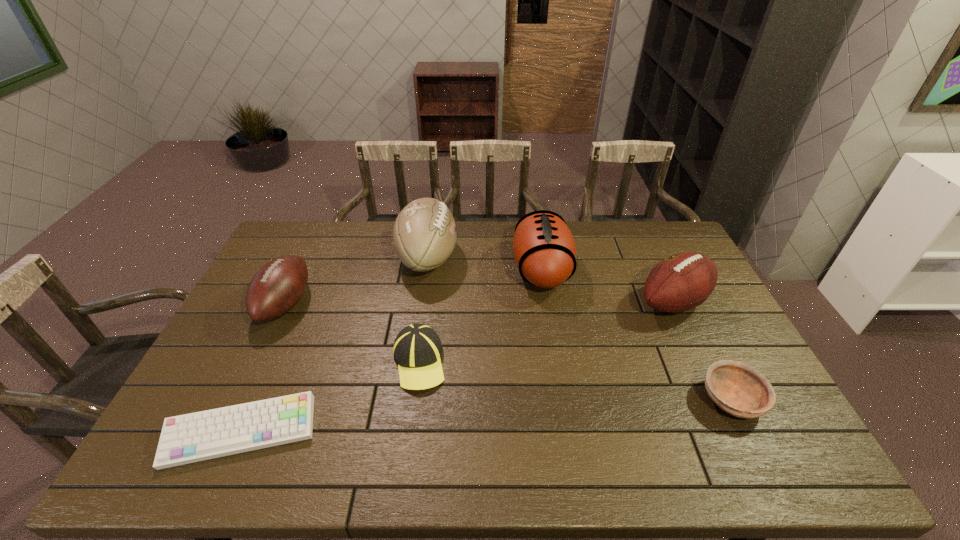
This screenshot has width=960, height=540. Identify the location of vacant space that is in between the fourth tallest object and the second football (American) from left to right. (356, 281).

This screenshot has width=960, height=540. Identify the location of free space between the baseball cap and the second football (American) from right to left. (480, 315).

Identify the location of unoccupied position between the bowl and the computer keyboard. This screenshot has height=540, width=960. (486, 416).

At what (x,y) coordinates should I click in order to perform the action: click on vacant area between the shortest football (American) and the shortest object. Please return your answer as a coordinate pair (x, y). Looking at the image, I should click on (263, 368).

The height and width of the screenshot is (540, 960). I want to click on vacant area that lies between the rightmost football (American) and the bowl, so click(702, 351).

The height and width of the screenshot is (540, 960). Identify the location of free space between the leftmost football (American) and the computer keyboard. (263, 368).

I want to click on vacant space that is in between the second football (American) from left to right and the computer keyboard, so click(334, 345).

I want to click on object that ranks as the fifth closest to the second football (American) from right to left, so click(194, 437).

Locate which object ranks fifth in proximity to the bowl. Please provide its 2D coordinates. Your answer should be formatted as a tuple, i.e. [(x, y)], where the tuple contains the x and y coordinates of a point satisfying the conditions above.

[(194, 437)]

Point out which football (American) is positioned as the third nearest to the rightmost football (American). Please provide its 2D coordinates. Your answer should be formatted as a tuple, i.e. [(x, y)], where the tuple contains the x and y coordinates of a point satisfying the conditions above.

[(277, 287)]